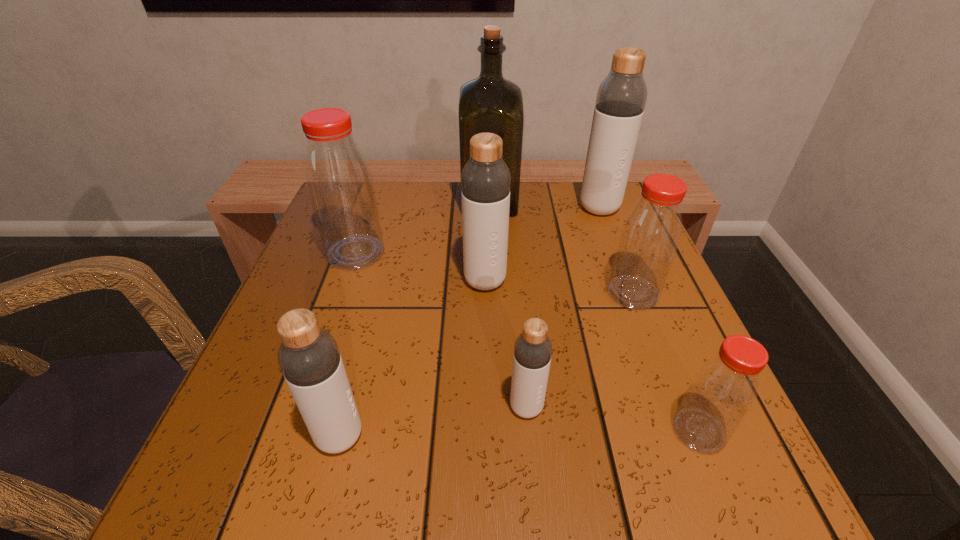
In the image, there is a desktop. Identify the location of vacant space at the far right corner. (577, 199).

Locate an element on the screen. vacant point located between the second smallest red bottle and the leftmost gray bottle is located at coordinates (487, 364).

Image resolution: width=960 pixels, height=540 pixels. Identify the location of vacant area that lies between the third nearest gray bottle and the leftmost gray bottle. (413, 359).

I want to click on empty space that is in between the smallest gray bottle and the second biggest gray bottle, so click(506, 344).

Where is `vacant area that lies between the second farthest gray bottle and the rightmost gray bottle`? This screenshot has height=540, width=960. vacant area that lies between the second farthest gray bottle and the rightmost gray bottle is located at coordinates click(542, 245).

Locate an element on the screen. The height and width of the screenshot is (540, 960). free spot between the smallest gray bottle and the nearest red bottle is located at coordinates (612, 419).

Where is `vacant point located between the second biggest gray bottle and the farthest gray bottle`? Image resolution: width=960 pixels, height=540 pixels. vacant point located between the second biggest gray bottle and the farthest gray bottle is located at coordinates (542, 245).

The height and width of the screenshot is (540, 960). I want to click on vacant space in between the smallest gray bottle and the farthest red bottle, so click(x=442, y=330).

Select which object is the fifth closest to the third biggest gray bottle. Please provide its 2D coordinates. Your answer should be formatted as a tuple, i.e. [(x, y)], where the tuple contains the x and y coordinates of a point satisfying the conditions above.

[(650, 235)]

At what (x,y) coordinates should I click in order to perform the action: click on object that is the seventh closest to the biggest gray bottle. Please return your answer as a coordinate pair (x, y). Looking at the image, I should click on point(309,358).